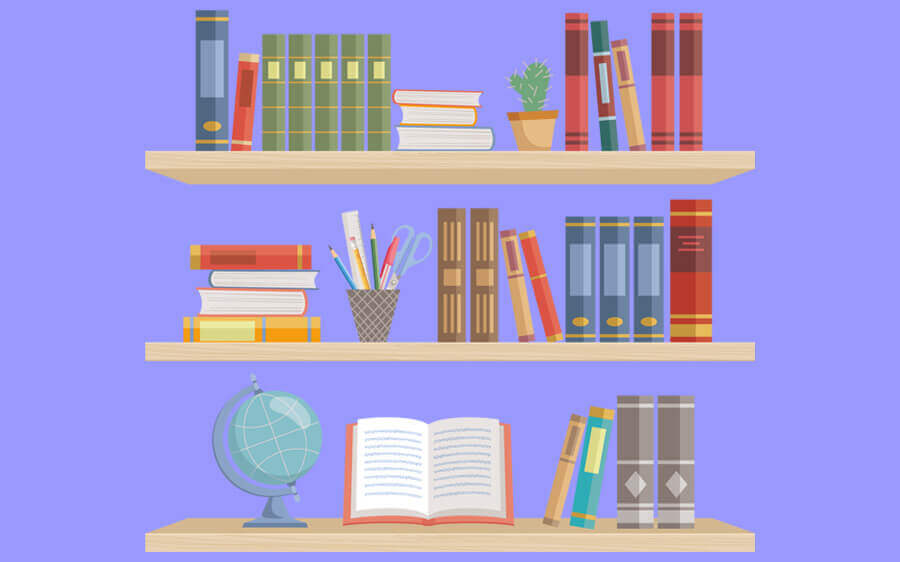
You are a GUI agent. You are given a task and a screenshot of the screen. Output one action in this format:
    pyautogui.click(x=<x>, y=<y>)
    Task: Click on the red spines of books
    
    Given the screenshot: What is the action you would take?
    pyautogui.click(x=572, y=104), pyautogui.click(x=246, y=116), pyautogui.click(x=270, y=250), pyautogui.click(x=543, y=284), pyautogui.click(x=691, y=303), pyautogui.click(x=664, y=97), pyautogui.click(x=689, y=107)